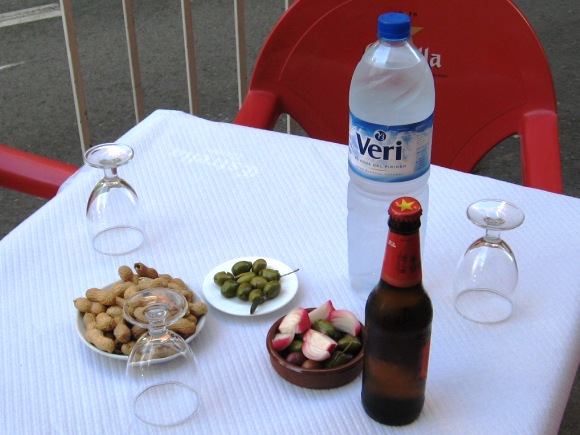
Find the location of `chair`. chair is located at coordinates (319, 124).